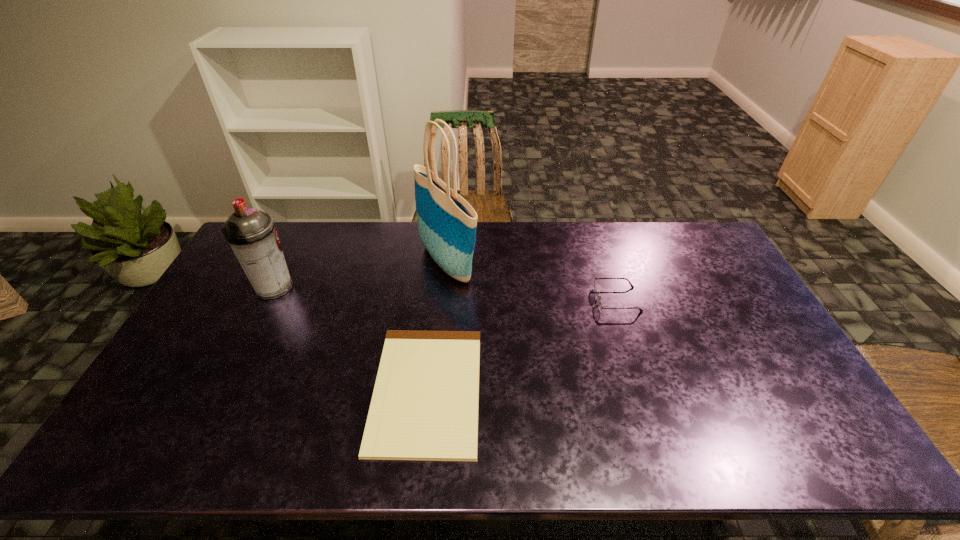
Where is `free space located 0.360m on the front-facing side of the spectacles`? The image size is (960, 540). free space located 0.360m on the front-facing side of the spectacles is located at coordinates (481, 299).

Identify the location of blank area located 0.050m on the front-facing side of the spectacles. This screenshot has width=960, height=540. (579, 299).

Where is `free space located on the right of the nearest object`? free space located on the right of the nearest object is located at coordinates pyautogui.click(x=503, y=389).

Where is `object that is at the far edge`? Image resolution: width=960 pixels, height=540 pixels. object that is at the far edge is located at coordinates (447, 223).

You are a GUI agent. You are given a task and a screenshot of the screen. Output one action in this format:
    pyautogui.click(x=<x>, y=<y>)
    Task: Click on the object that is at the near edge
    Image resolution: width=960 pixels, height=540 pixels.
    Given the screenshot: What is the action you would take?
    pyautogui.click(x=424, y=407)

Identify the location of object present at the left edge. Image resolution: width=960 pixels, height=540 pixels. (251, 233).

Locate an element on the screen. free space at the far edge is located at coordinates (564, 230).

Locate an element on the screen. The height and width of the screenshot is (540, 960). free spot at the near edge of the desktop is located at coordinates (584, 430).

What are the coordinates of `free space at the left edge` in the screenshot? It's located at (155, 399).

The height and width of the screenshot is (540, 960). I want to click on vacant area at the near right corner of the desktop, so click(x=772, y=437).